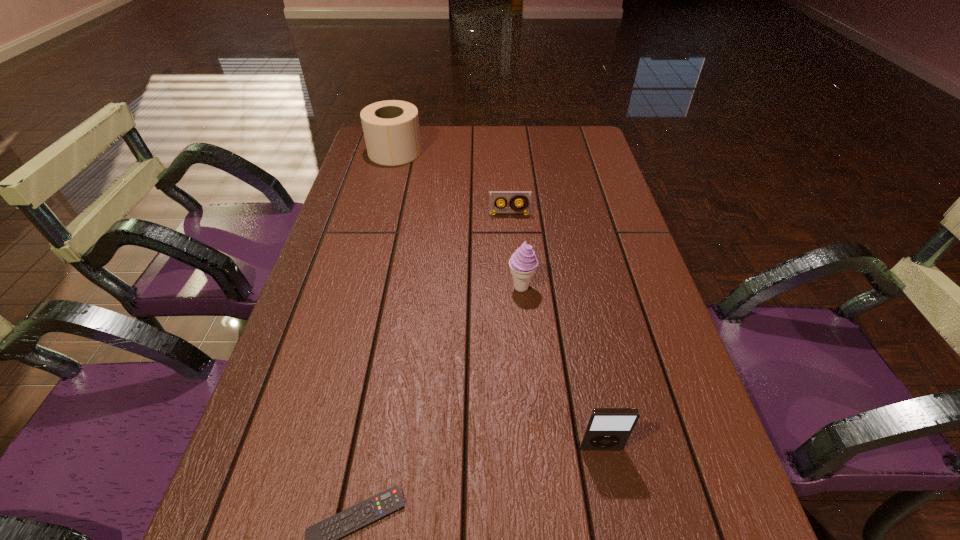
What are the coordinates of `toilet tissue` in the screenshot? It's located at (391, 130).

Locate an element on the screen. The image size is (960, 540). the third farthest object is located at coordinates (523, 263).

The height and width of the screenshot is (540, 960). Find the location of `the fourth farthest object`. the fourth farthest object is located at coordinates pyautogui.click(x=606, y=428).

Locate an element on the screen. This screenshot has height=540, width=960. iPod is located at coordinates (606, 428).

You are a GUI agent. You are given a task and a screenshot of the screen. Output one action in this format:
    pyautogui.click(x=<x>, y=<y>)
    Task: Click on the second farthest object
    This screenshot has width=960, height=540.
    Given the screenshot: What is the action you would take?
    pyautogui.click(x=495, y=197)

Identify the location of videotape. (495, 197).

At what (x,y) coordinates should I click in order to perform the action: click on free space located on the right of the farthest object. Please return your answer as a coordinate pair (x, y). Looking at the image, I should click on (461, 152).

Identify the location of vacant region located on the left of the icecream. Image resolution: width=960 pixels, height=540 pixels. (464, 288).

Find the location of `blank space located on the front-facing side of the rightmost object`. blank space located on the front-facing side of the rightmost object is located at coordinates (618, 538).

This screenshot has width=960, height=540. Find the location of `free space located at the front of the fourth nearest object with visible reels`. free space located at the front of the fourth nearest object with visible reels is located at coordinates (516, 303).